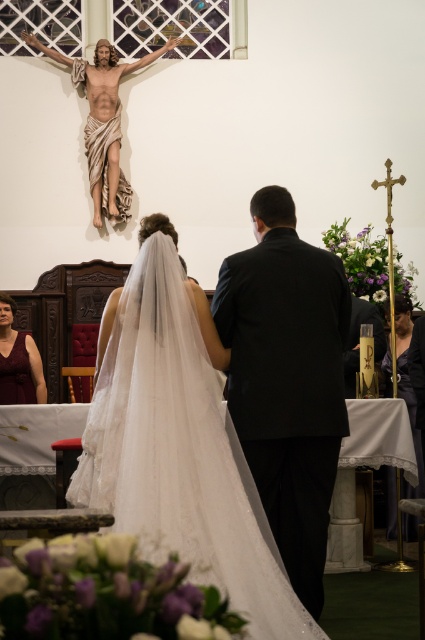
You are a photographer positioned at the back of the church during the wedding ceremony. You need to capture a photo of the couple and the crucifix. The black satin suit at center and the matte gold statue at upper center are in your view. Which object is positioned to the right of the other?

The black satin suit at center is to the right of the matte gold statue at upper center.